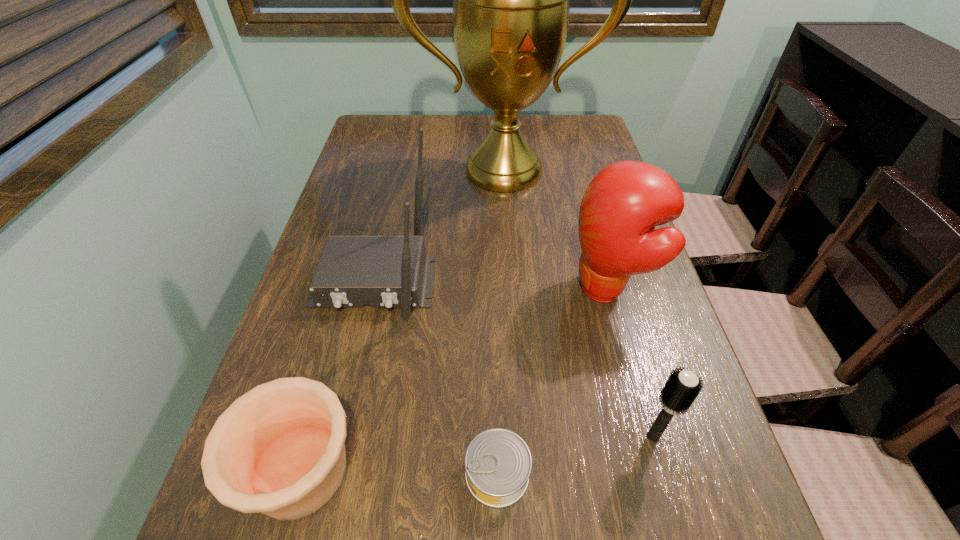
Find the location of `the tallest object`. the tallest object is located at coordinates (511, 0).

Identify the location of the farthest object. (511, 0).

Where is `router`? This screenshot has height=540, width=960. router is located at coordinates (381, 271).

Locate an element on the screen. This screenshot has height=540, width=960. boxing glove is located at coordinates (622, 205).

I want to click on the third shortest object, so click(x=681, y=389).

Locate an element on the screen. The image size is (960, 540). pottery is located at coordinates (278, 449).

Locate an element on the screen. the shortest object is located at coordinates coord(498,463).

Where is `vacant space positioned on the surface of the farthest object with symbols`? This screenshot has width=960, height=540. vacant space positioned on the surface of the farthest object with symbols is located at coordinates (512, 290).

The image size is (960, 540). In order to click on blank space located on the back of the router to connect cables in this screenshot , I will do `click(346, 407)`.

Where is `vacant space located on the striking surface of the boxing glove`? vacant space located on the striking surface of the boxing glove is located at coordinates (402, 289).